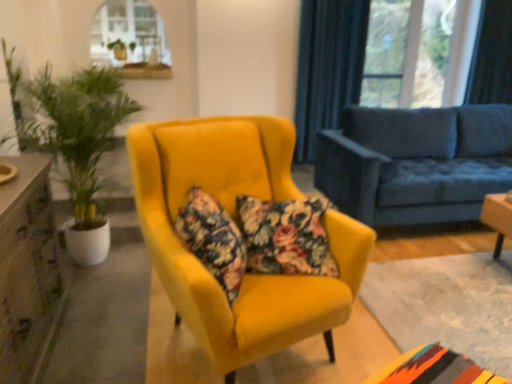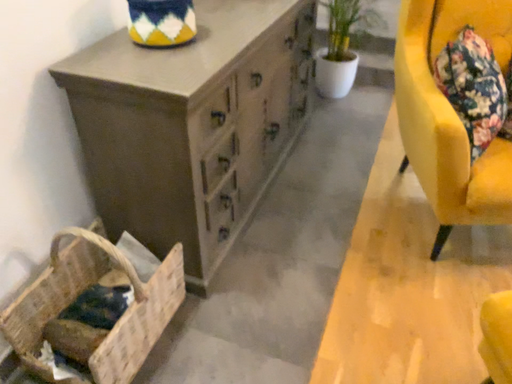
Question: Which way did the camera rotate in the video?

Choices:
 (A) rotated left
 (B) rotated right

Answer: (A)